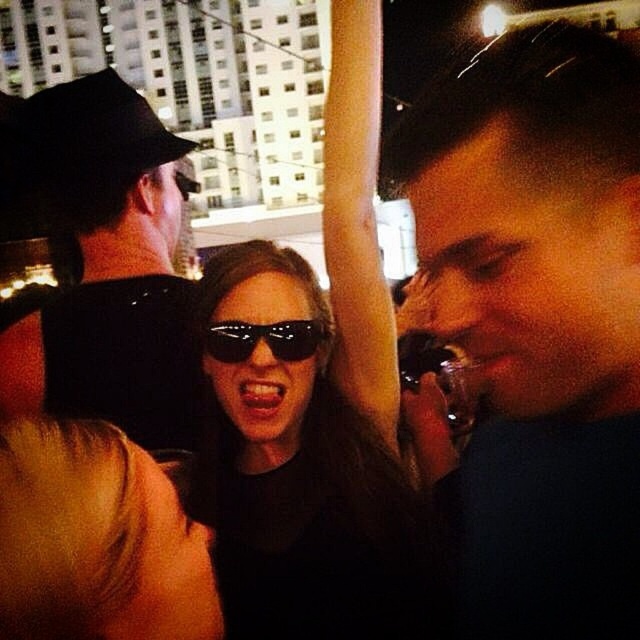
Does black matte cap at upper left appear on the right side of black reflective sunglasses at center?

In fact, black matte cap at upper left is to the left of black reflective sunglasses at center.

Who is positioned more to the right, black matte cap at upper left or black reflective sunglasses at center?

Positioned to the right is black reflective sunglasses at center.

This screenshot has width=640, height=640. In order to click on black matte cap at upper left in this screenshot , I will do `click(108, 266)`.

Is black matte cap at upper left above black matte baseball hat at upper left?

No, black matte cap at upper left is not above black matte baseball hat at upper left.

Does black matte cap at upper left have a greater width compared to black matte baseball hat at upper left?

Yes, black matte cap at upper left is wider than black matte baseball hat at upper left.

What do you see at coordinates (108, 266) in the screenshot? I see `black matte cap at upper left` at bounding box center [108, 266].

Where is `black matte cap at upper left`? black matte cap at upper left is located at coordinates (108, 266).

Does black matte baseball hat at upper left appear over black reflective sunglasses at center?

Yes.

Is black matte baseball hat at upper left taller than black reflective sunglasses at center?

Yes, black matte baseball hat at upper left is taller than black reflective sunglasses at center.

Where is `black matte baseball hat at upper left`? The height and width of the screenshot is (640, 640). black matte baseball hat at upper left is located at coordinates (90, 131).